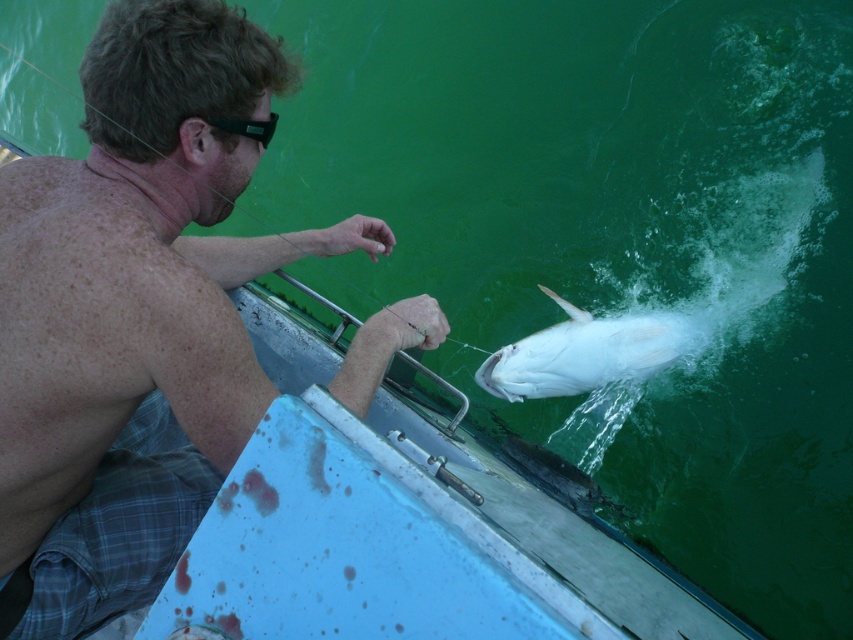
Question: Considering the real-world distances, which object is farthest from the black plastic goggles at upper left?

Choices:
 (A) white glossy fish at lower center
 (B) shiny skin man at upper left

Answer: (A)

Question: Which object is the farthest from the shiny skin man at upper left?

Choices:
 (A) black plastic goggles at upper left
 (B) white glossy fish at lower center

Answer: (B)

Question: Is shiny skin man at upper left below white glossy fish at lower center?

Choices:
 (A) no
 (B) yes

Answer: (A)

Question: Which object is the farthest from the shiny skin man at upper left?

Choices:
 (A) white glossy fish at lower center
 (B) black plastic goggles at upper left

Answer: (A)

Question: Does shiny skin man at upper left come in front of white glossy fish at lower center?

Choices:
 (A) no
 (B) yes

Answer: (B)

Question: Does shiny skin man at upper left appear under black plastic goggles at upper left?

Choices:
 (A) no
 (B) yes

Answer: (B)